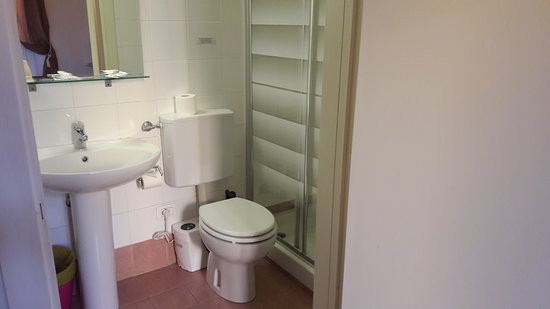
Where is `flush tank`? This screenshot has height=309, width=550. flush tank is located at coordinates (199, 154).